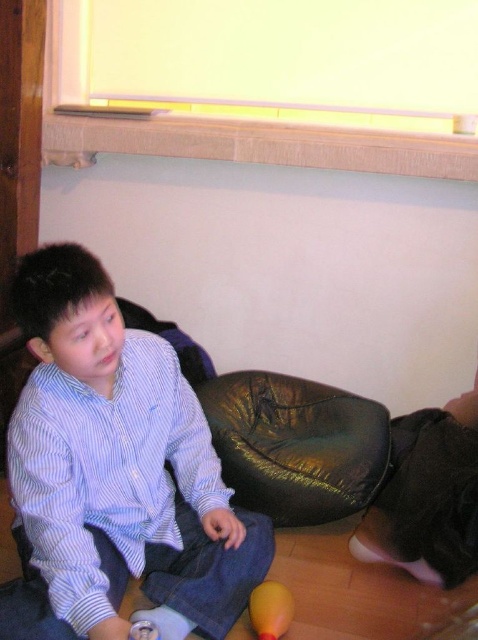
Does blue striped shirt at center appear on the right side of yellow rubber ball at lower center?

Incorrect, blue striped shirt at center is not on the right side of yellow rubber ball at lower center.

Who is higher up, blue striped shirt at center or yellow rubber ball at lower center?

blue striped shirt at center is higher up.

Between point (90, 484) and point (278, 624), which one is positioned behind?

Point (278, 624)

You are a GUI agent. You are given a task and a screenshot of the screen. Output one action in this format:
    pyautogui.click(x=<x>, y=<y>)
    Task: Click on the blue striped shirt at center
    The height and width of the screenshot is (640, 478).
    Given the screenshot: What is the action you would take?
    pyautogui.click(x=118, y=467)

Can you confirm if shiny gold bean bag chair at center is bigger than yellow rubber ball at lower center?

Correct, shiny gold bean bag chair at center is larger in size than yellow rubber ball at lower center.

Who is more distant from viewer, (315, 410) or (264, 612)?

Point (315, 410)

Is point (326, 451) behind point (262, 627)?

Yes.

Where is `shiny gold bean bag chair at center`? Image resolution: width=478 pixels, height=640 pixels. shiny gold bean bag chair at center is located at coordinates (295, 445).

Can you confirm if blue striped shirt at center is positioned to the right of shiny gold bean bag chair at center?

No, blue striped shirt at center is not to the right of shiny gold bean bag chair at center.

Who is shorter, blue striped shirt at center or shiny gold bean bag chair at center?

shiny gold bean bag chair at center

From the picture: Who is more forward, (x=138, y=406) or (x=300, y=449)?

Point (x=138, y=406)

You are a GUI agent. You are given a task and a screenshot of the screen. Output one action in this format:
    pyautogui.click(x=<x>, y=<y>)
    Task: Click on the blue striped shirt at center
    The height and width of the screenshot is (640, 478).
    Given the screenshot: What is the action you would take?
    pyautogui.click(x=118, y=467)